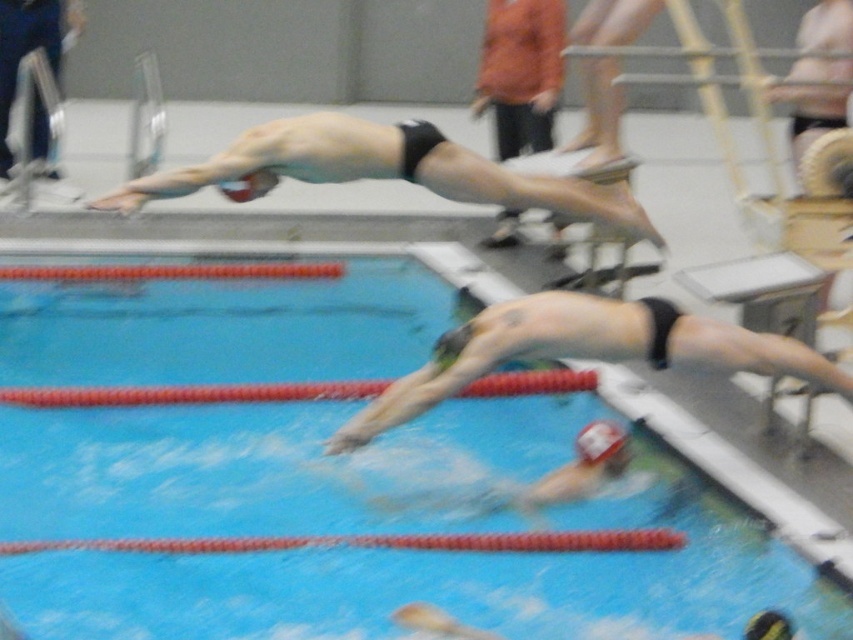
Question: Does blue smooth water at center have a larger size compared to black matte swim cap at upper center?

Choices:
 (A) yes
 (B) no

Answer: (A)

Question: Estimate the real-world distances between objects in this image. Which object is closer to the blue smooth water at center?

Choices:
 (A) matte black swim cap at upper center
 (B) black matte swim cap at center
 (C) black matte swim cap at upper center

Answer: (B)

Question: Can you confirm if blue smooth water at center is wider than black matte swim cap at upper center?

Choices:
 (A) no
 (B) yes

Answer: (B)

Question: Considering the real-world distances, which object is farthest from the black matte swim cap at upper center?

Choices:
 (A) black matte swim cap at center
 (B) blue smooth water at center

Answer: (B)

Question: Is black matte swim cap at center smaller than matte black swim cap at upper center?

Choices:
 (A) yes
 (B) no

Answer: (B)

Question: Which point is closer to the camera?

Choices:
 (A) tap(36, 131)
 (B) tap(288, 145)
 (C) tap(253, 456)

Answer: (C)